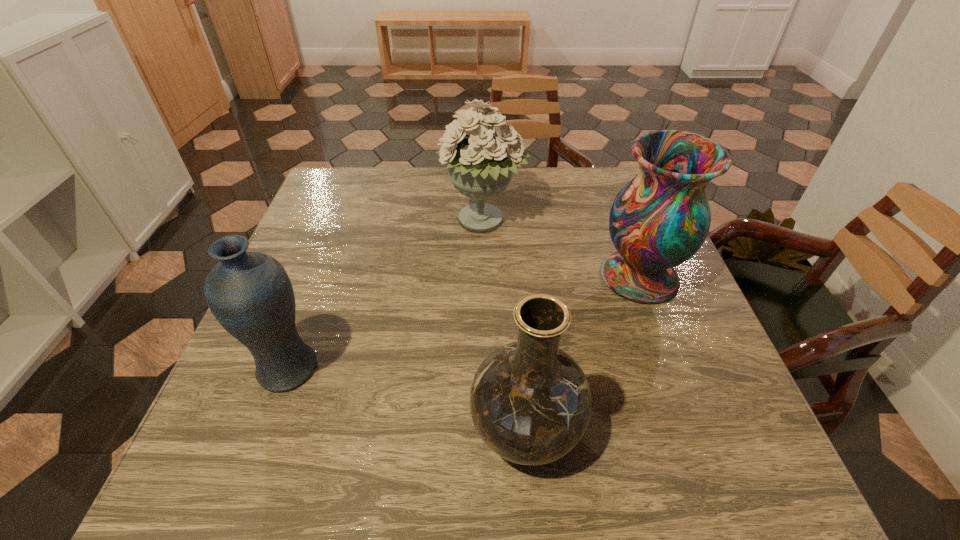
You are a GUI agent. You are given a task and a screenshot of the screen. Output one action in this format:
    pyautogui.click(x=<x>, y=<y>)
    Task: Click on the object that ranks as the third closest to the farthest object
    
    Given the screenshot: What is the action you would take?
    pyautogui.click(x=531, y=403)

Image resolution: width=960 pixels, height=540 pixels. What are the coordinates of `vase that can be found as the second closest to the bouquet` in the screenshot? It's located at (250, 294).

Where is `vase identified as the second closest to the rightmost vase`? This screenshot has width=960, height=540. vase identified as the second closest to the rightmost vase is located at coordinates (250, 294).

I want to click on free space that satisfies the following two spatial constraints: 1. on the back side of the rightmost vase; 2. on the left side of the second vase from right to left, so click(514, 277).

Image resolution: width=960 pixels, height=540 pixels. In order to click on vacant position in the image that satisfies the following two spatial constraints: 1. on the front side of the second vase from right to left; 2. on the right side of the leftmost object in this screenshot , I will do `click(266, 429)`.

The height and width of the screenshot is (540, 960). Identify the location of vacant space that satisfies the following two spatial constraints: 1. on the front side of the second vase from left to right; 2. on the right side of the leftmost vase. (266, 429).

Find the location of `vacant space that satisfies the following two spatial constraints: 1. on the back side of the third nearest object; 2. on the left side of the leftmost object`. vacant space that satisfies the following two spatial constraints: 1. on the back side of the third nearest object; 2. on the left side of the leftmost object is located at coordinates (323, 277).

The height and width of the screenshot is (540, 960). I want to click on vacant region that satisfies the following two spatial constraints: 1. on the front side of the rightmost vase; 2. on the left side of the bouquet, so click(x=483, y=277).